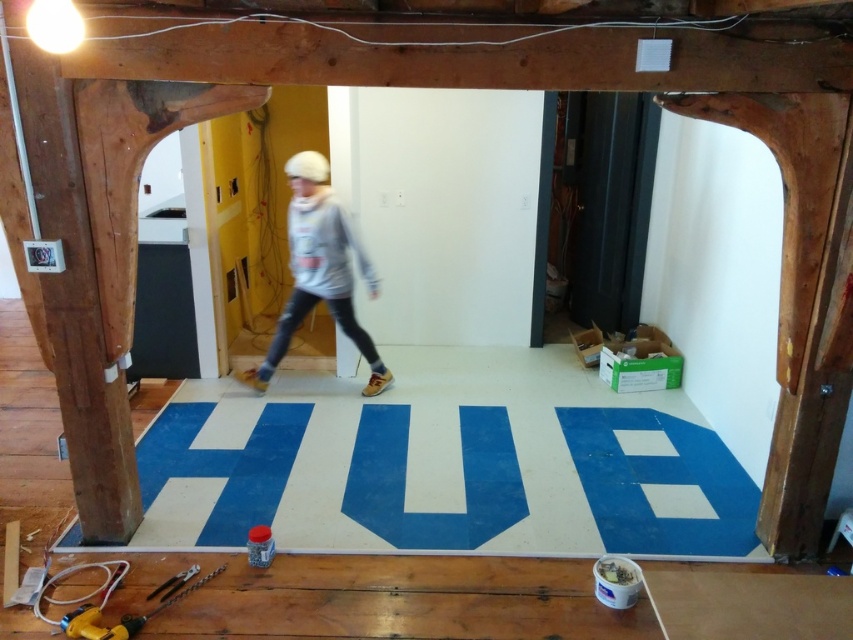
Based on the photo, you are standing in the construction area and need to locate the gray fleece sweatshirt at center. According to the coordinates provided, where would you find it?

The gray fleece sweatshirt at center is located at the 2D coordinates point (320, 269).